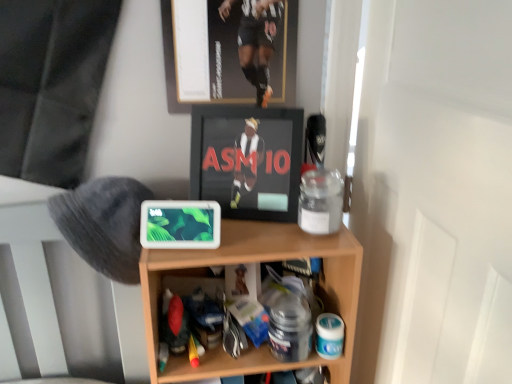
Question: Considering the positions of wooden shelf at center and gray fuzzy hat at left in the image, is wooden shelf at center taller or shorter than gray fuzzy hat at left?

Choices:
 (A) short
 (B) tall

Answer: (B)

Question: From the image's perspective, relative to gray fuzzy hat at left, is wooden shelf at center above or below?

Choices:
 (A) below
 (B) above

Answer: (A)

Question: Which of these objects is positioned farthest from the metallic gold picture frame at upper center?

Choices:
 (A) wooden shelf at center
 (B) gray fuzzy hat at left
 (C) black glossy frame at center

Answer: (B)

Question: Considering the real-world distances, which object is farthest from the wooden shelf at center?

Choices:
 (A) gray fuzzy hat at left
 (B) metallic gold picture frame at upper center
 (C) black glossy frame at center

Answer: (B)